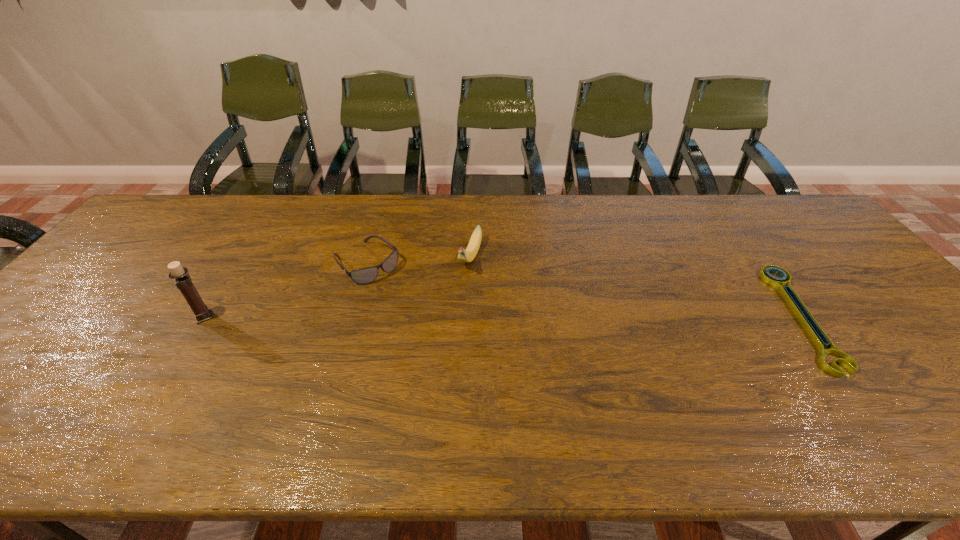
Identify the location of free spot located at the stem of the second object from right to left. The image size is (960, 540). click(x=462, y=290).

You are a GUI agent. You are given a task and a screenshot of the screen. Output one action in this format:
    pyautogui.click(x=<x>, y=<y>)
    Task: Click on the vacant point located at the stem of the second object from right to left
    
    Given the screenshot: What is the action you would take?
    pyautogui.click(x=458, y=298)

You are a GUI agent. You are given a task and a screenshot of the screen. Output one action in this format:
    pyautogui.click(x=<x>, y=<y>)
    Task: Click on the blank space located at the stem of the second object from right to left
    
    Given the screenshot: What is the action you would take?
    pyautogui.click(x=457, y=300)

You are a GUI agent. You are given a task and a screenshot of the screen. Output one action in this format:
    pyautogui.click(x=<x>, y=<y>)
    Task: Click on the free location located 0.070m on the lenses of the third tallest object
    
    Given the screenshot: What is the action you would take?
    pyautogui.click(x=399, y=293)

Locate an element on the screen. This screenshot has height=540, width=960. vacant region located on the lenses of the third tallest object is located at coordinates (450, 339).

This screenshot has height=540, width=960. In order to click on free region located 0.130m on the lenses of the third tallest object in this screenshot , I will do `click(412, 304)`.

The image size is (960, 540). In order to click on object that is at the near edge in this screenshot , I will do [816, 333].

In the image, there is a desktop. At what (x,y) coordinates should I click in order to perform the action: click on vacant space at the far edge. Please return your answer as a coordinate pair (x, y). Looking at the image, I should click on (367, 232).

You are a GUI agent. You are given a task and a screenshot of the screen. Output one action in this format:
    pyautogui.click(x=<x>, y=<y>)
    Task: Click on the free spot at the near edge of the desktop
    The height and width of the screenshot is (540, 960).
    Given the screenshot: What is the action you would take?
    pyautogui.click(x=156, y=374)

This screenshot has height=540, width=960. In the image, there is a desktop. In order to click on vacant area at the left edge in this screenshot , I will do `click(44, 346)`.